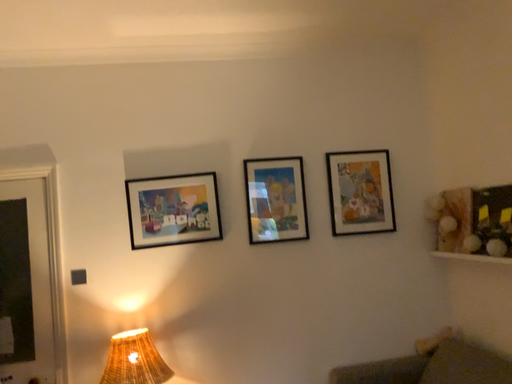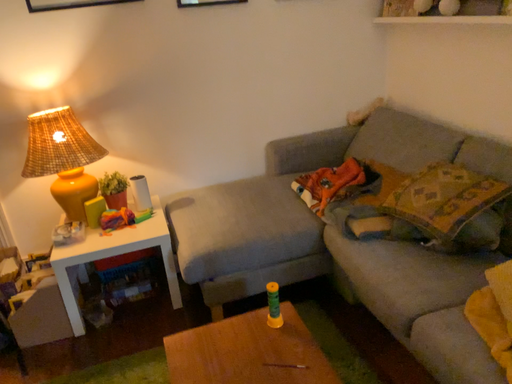
Question: How did the camera likely rotate when shooting the video?

Choices:
 (A) rotated downward
 (B) rotated upward

Answer: (A)